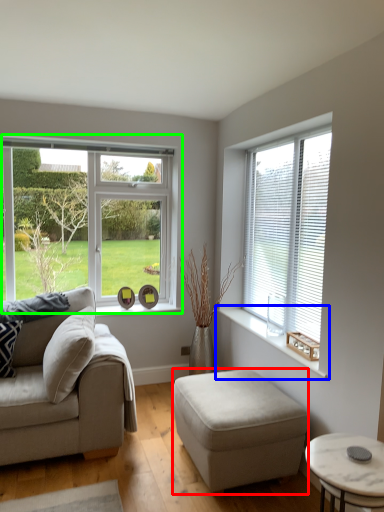
Question: Which object is positioned closest to stool (highlighted by a red box)? Select from window sill (highlighted by a blue box) and window (highlighted by a green box).

Choices:
 (A) window sill
 (B) window

Answer: (A)